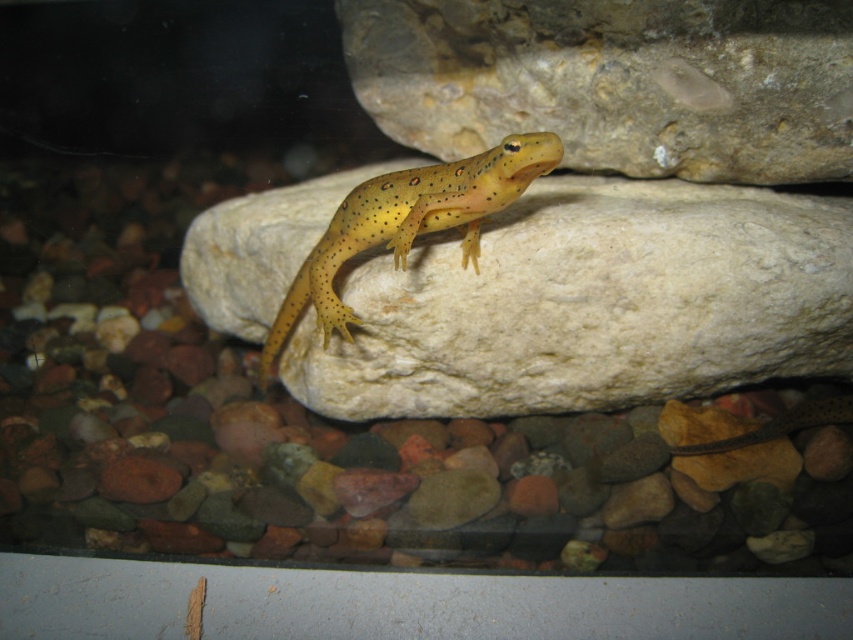
In the scene shown: Which is more to the right, white smooth rock at center or yellow spotted lizard at center?

white smooth rock at center is more to the right.

Between white smooth rock at center and yellow spotted lizard at center, which one has less height?

yellow spotted lizard at center is shorter.

Locate an element on the screen. The height and width of the screenshot is (640, 853). white smooth rock at center is located at coordinates (590, 305).

Who is more distant from viewer, (631, 369) or (674, 22)?

The point (631, 369) is more distant.

Measure the distance between white smooth rock at center and camera.

white smooth rock at center is 1.31 meters from camera.

The height and width of the screenshot is (640, 853). Find the location of `white smooth rock at center`. white smooth rock at center is located at coordinates (590, 305).

Is smooth rock at upper center behind yellow spotted lizard at center?

Yes, it is behind yellow spotted lizard at center.

Can you confirm if smooth rock at upper center is smaller than yellow spotted lizard at center?

Actually, smooth rock at upper center might be larger than yellow spotted lizard at center.

The image size is (853, 640). Describe the element at coordinates (614, 81) in the screenshot. I see `smooth rock at upper center` at that location.

Locate an element on the screen. smooth rock at upper center is located at coordinates (614, 81).